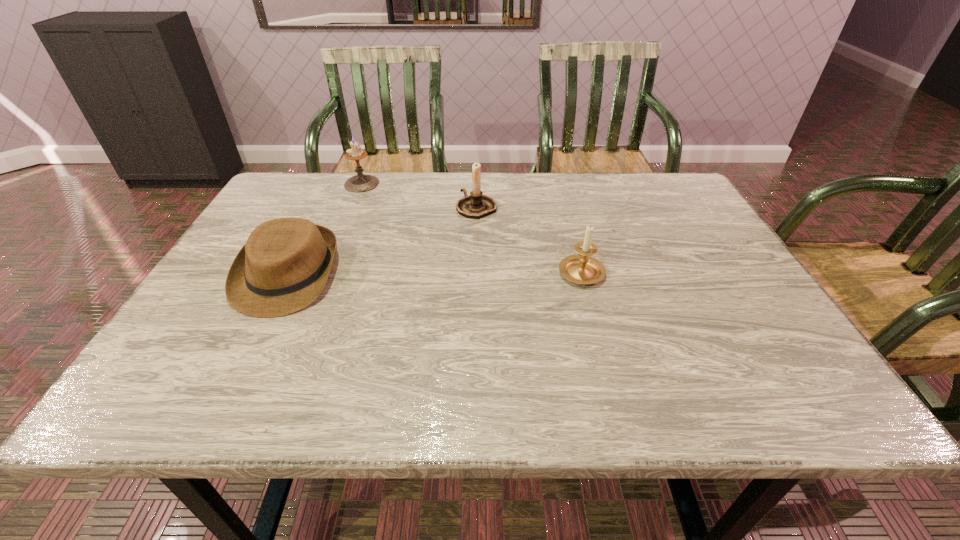
Locate an element on the screen. free region located 0.170m with a handle on the side of the rightmost object is located at coordinates (565, 215).

What are the coordinates of `free location located with a handle on the side of the rightmost object` in the screenshot? It's located at point(564,210).

Where is `vacant space located 0.060m on the front-facing side of the fedora`? The width and height of the screenshot is (960, 540). vacant space located 0.060m on the front-facing side of the fedora is located at coordinates (254, 340).

I want to click on object that is at the left edge, so click(x=283, y=267).

You are a GUI agent. You are given a task and a screenshot of the screen. Output one action in this format:
    pyautogui.click(x=<x>, y=<y>)
    Task: Click on the free space at the far edge of the desktop
    The image size is (960, 540).
    Given the screenshot: What is the action you would take?
    pyautogui.click(x=623, y=205)

In the image, there is a desktop. Where is `vacant area at the near edge`? vacant area at the near edge is located at coordinates (550, 387).

The width and height of the screenshot is (960, 540). In the image, there is a desktop. In order to click on vacant space at the right edge in this screenshot , I will do `click(711, 296)`.

You are a GUI agent. You are given a task and a screenshot of the screen. Output one action in this format:
    pyautogui.click(x=<x>, y=<y>)
    Task: Click on the vacant area at the far left corner
    The height and width of the screenshot is (540, 960).
    Given the screenshot: What is the action you would take?
    pyautogui.click(x=313, y=172)

You are a GUI agent. You are given a task and a screenshot of the screen. Output one action in this format:
    pyautogui.click(x=<x>, y=<y>)
    Task: Click on the free space at the near left corner of the desktop
    
    Given the screenshot: What is the action you would take?
    pyautogui.click(x=166, y=392)

Where is `free spot at the far right corner of the desktop`? The image size is (960, 540). free spot at the far right corner of the desktop is located at coordinates (628, 174).